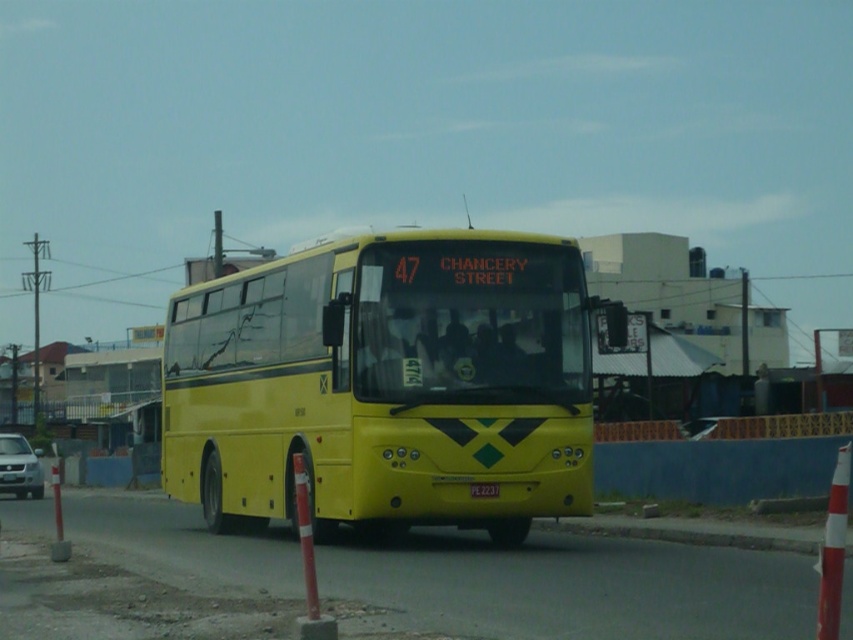
You are a pedestrian standing at the side of the road and see the yellow matte bus at center and the silver metallic car at lower left approaching. Which vehicle is taller?

The yellow matte bus at center is taller than the silver metallic car at lower left.

You are a pedestrian standing on the sidewalk and see the yellow matte bus at center and the silver metallic car at lower left. Which vehicle is closer to you?

The yellow matte bus at center is closer to you because it is positioned over the silver metallic car at lower left, indicating it is in front of the car.